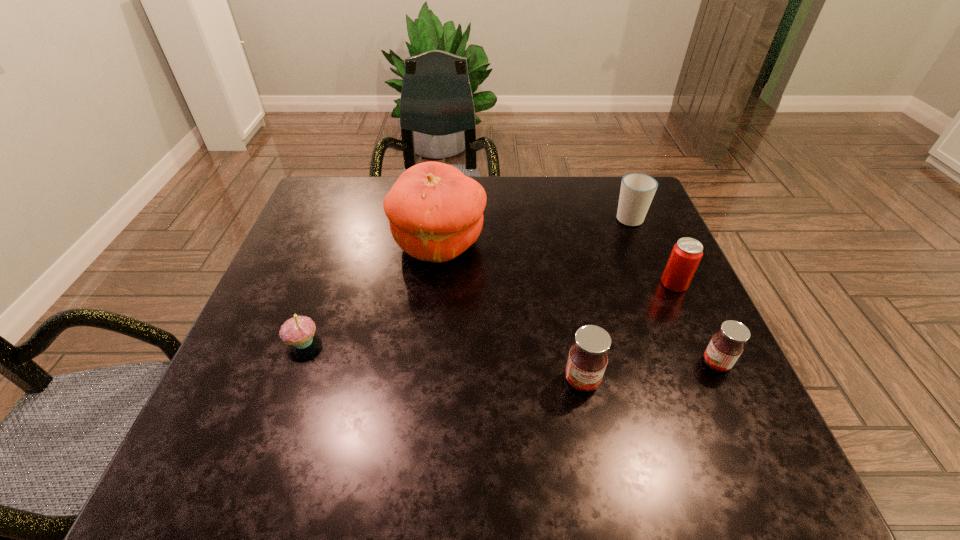
In the image, there is a desktop. What are the coordinates of `free space at the near left corner` in the screenshot? It's located at (290, 401).

Find the location of a particular element. The height and width of the screenshot is (540, 960). vacant space in between the leftmost object and the can is located at coordinates (489, 313).

The width and height of the screenshot is (960, 540). I want to click on vacant space that's between the taller jam and the cup, so click(x=606, y=299).

At what (x,y) coordinates should I click in order to perform the action: click on free spot between the cupcake and the third object from left to right. Please return your answer as a coordinate pair (x, y). This screenshot has width=960, height=540. Looking at the image, I should click on (443, 361).

I want to click on empty space between the leftmost object and the can, so click(489, 313).

Where is `vacant space that is in between the tallest object and the can`? The height and width of the screenshot is (540, 960). vacant space that is in between the tallest object and the can is located at coordinates (557, 264).

In order to click on free spot between the cupcake and the can in this screenshot , I will do `click(489, 313)`.

This screenshot has width=960, height=540. In order to click on free space between the tallest object and the left jam in this screenshot , I will do click(x=511, y=312).

This screenshot has width=960, height=540. I want to click on empty space that is in between the left jam and the cup, so click(x=606, y=299).

Find the location of a particular element. The height and width of the screenshot is (540, 960). free spot between the tallest object and the right jam is located at coordinates click(577, 303).